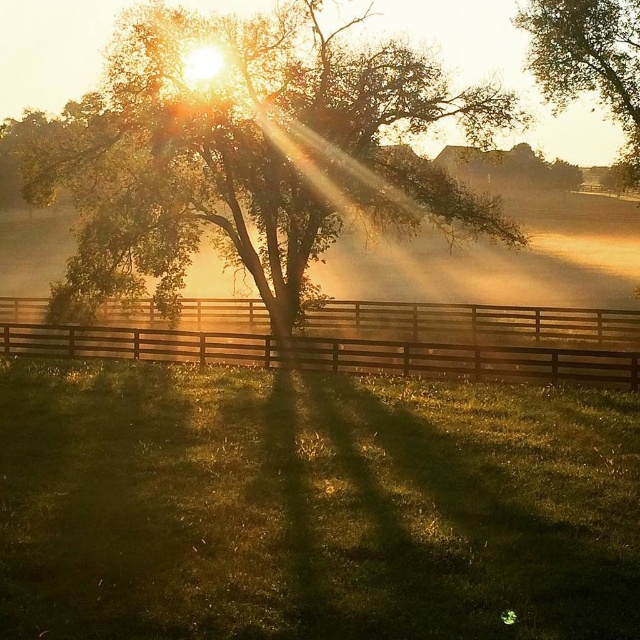
You are standing in the middle of the field and see the brown wooden fence at center. If you walk straight towards the fence, will you reach it before the point marked at coordinate (476, 340)?

The point at coordinate (476, 340) corresponds to the brown wooden fence at center, so walking straight towards the fence will lead you directly to that point. Therefore, you will reach the fence at the specified coordinate.

You are a photographer trying to capture the shadow of the green leafy tree at center and the brown wooden fence at center in your shot. Which object will cast a longer shadow? Please explain your reasoning based on their positions.

The green leafy tree at center is positioned on the left side of brown wooden fence at center. Since the sun is high in the sky, both shadows would be shorter. However, the tree is taller than the fence, so its shadow would be longer than the brown wooden fence at center.